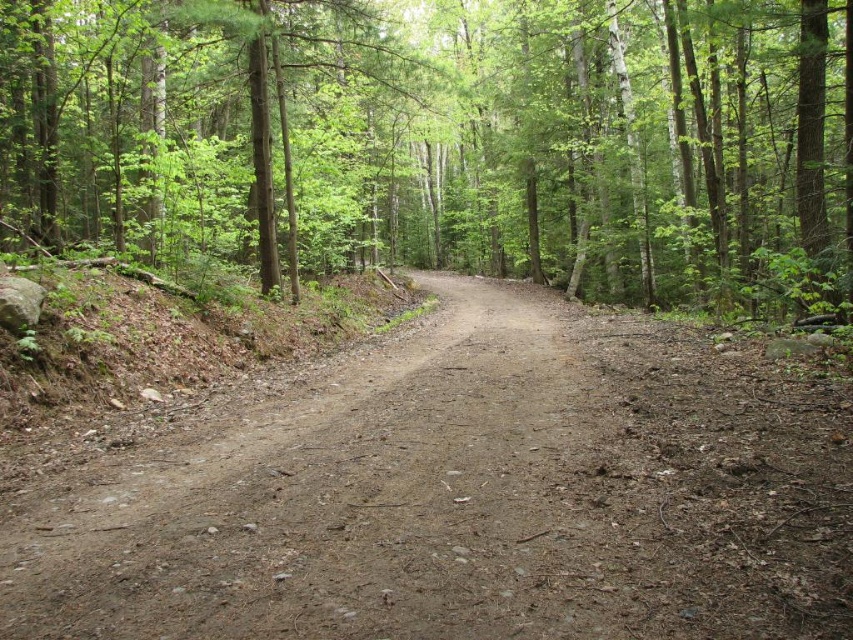
Based on the photo, who is higher up, brown textured dirt path at center or brown gravel path at center?

brown textured dirt path at center is higher up.

In the scene shown: Is brown textured dirt path at center closer to the viewer compared to brown gravel path at center?

No, brown textured dirt path at center is further to the viewer.

In order to click on brown textured dirt path at center in this screenshot , I will do `click(444, 140)`.